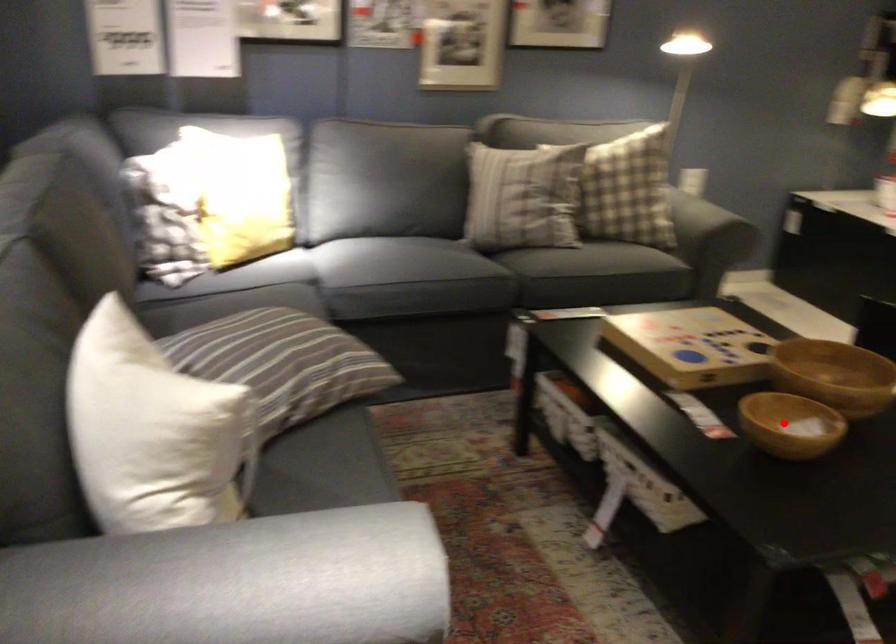
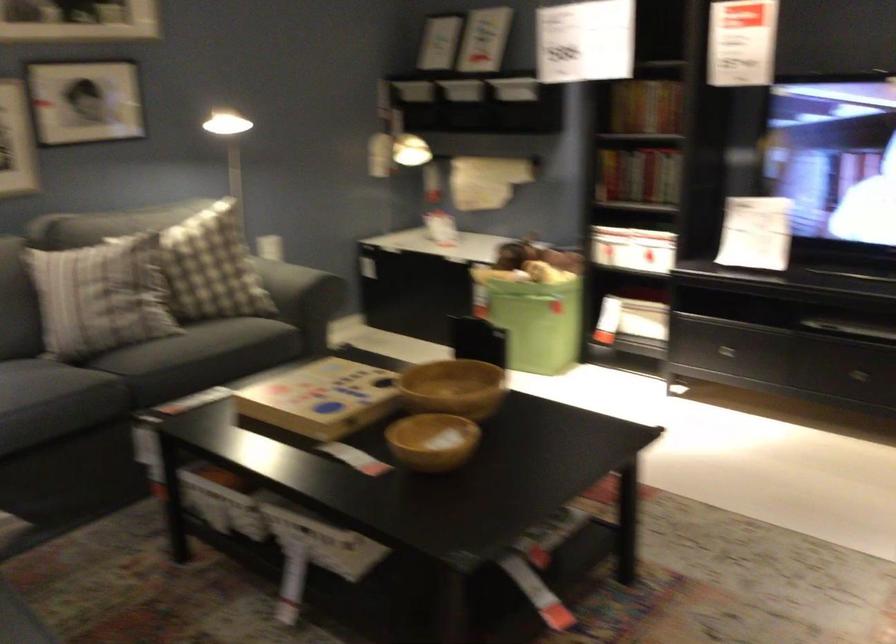
Question: A red point is marked in image1. In image2, is the corresponding 3D point closer to the camera or farther? Reply with the corresponding letter.

Choices:
 (A) The corresponding 3D point is closer.
 (B) The corresponding 3D point is farther.

Answer: (B)